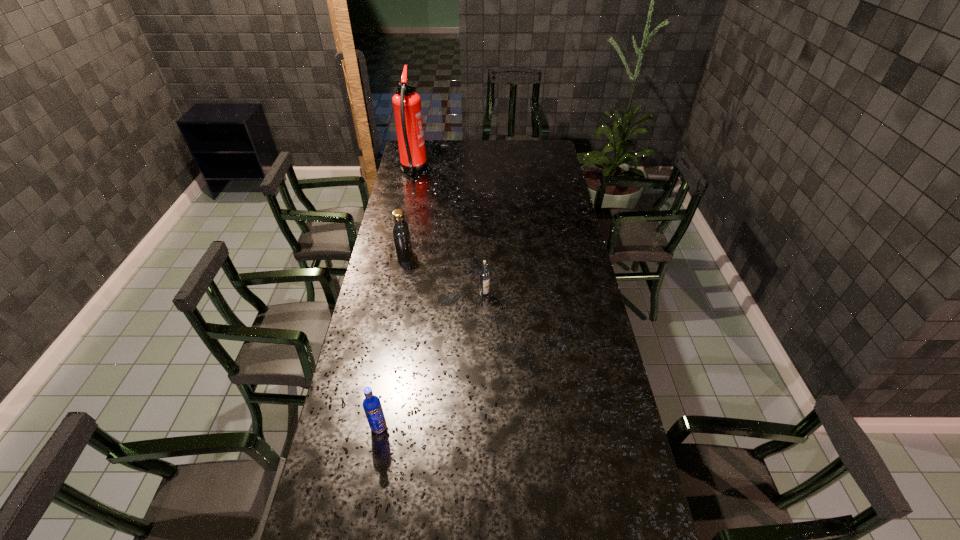
This screenshot has width=960, height=540. I want to click on free region that satisfies the following two spatial constraints: 1. at the nozzle of the nearest vodka; 2. on the right side of the fire extinguisher, so click(x=360, y=427).

Locate an element on the screen. free point that satisfies the following two spatial constraints: 1. on the front-facing side of the nearest vodka; 2. on the left side of the second farthest object is located at coordinates (372, 427).

The width and height of the screenshot is (960, 540). I want to click on free region that satisfies the following two spatial constraints: 1. on the front-facing side of the nearest vodka; 2. on the left side of the farthest vodka, so click(x=372, y=427).

The image size is (960, 540). I want to click on vacant point that satisfies the following two spatial constraints: 1. on the front-facing side of the nearest object; 2. on the left side of the farthest vodka, so click(372, 427).

At what (x,y) coordinates should I click in order to perform the action: click on vacant region that satisfies the following two spatial constraints: 1. on the front-facing side of the farthest vodka; 2. on the back side of the nearest vodka. Please return your answer as a coordinate pair (x, y). The width and height of the screenshot is (960, 540). Looking at the image, I should click on (372, 427).

Identify the location of free location that satisfies the following two spatial constraints: 1. on the front-facing side of the farthest vodka; 2. on the right side of the nearest vodka. The height and width of the screenshot is (540, 960). (372, 427).

What are the coordinates of `free space that satisfies the following two spatial constraints: 1. at the nozzle of the nearest object; 2. on the right side of the tallest object` in the screenshot? It's located at (360, 427).